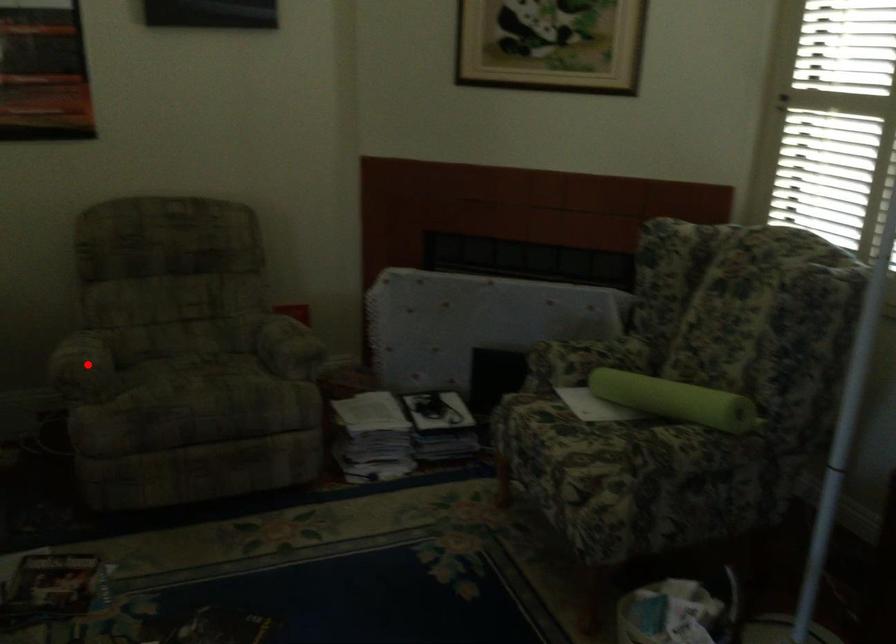
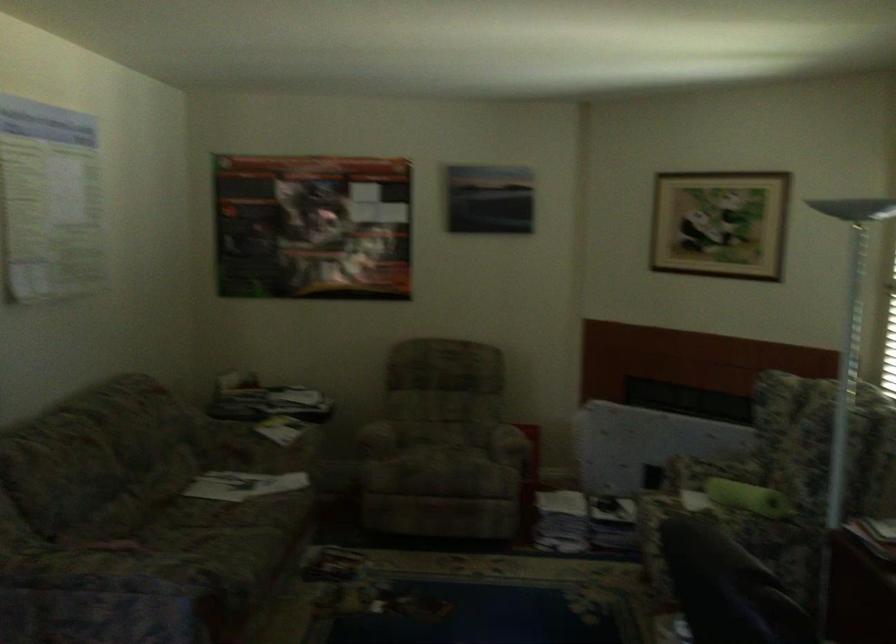
Question: I am providing you with two images of the same scene from different viewpoints. A red point is marked on the first image. Is the red point's position out of view in image 2?

Choices:
 (A) Yes
 (B) No

Answer: (B)